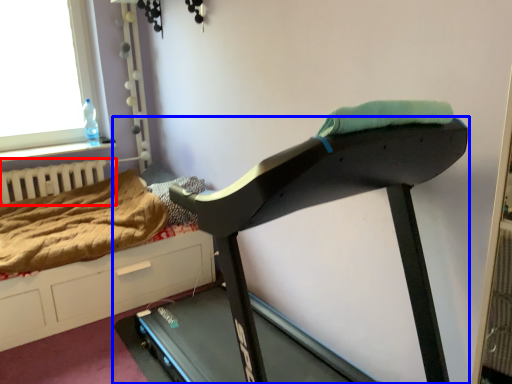
Question: Which object appears closest to the camera in this image, radiator (highlighted by a red box) or treadmill (highlighted by a blue box)?

Choices:
 (A) radiator
 (B) treadmill

Answer: (B)